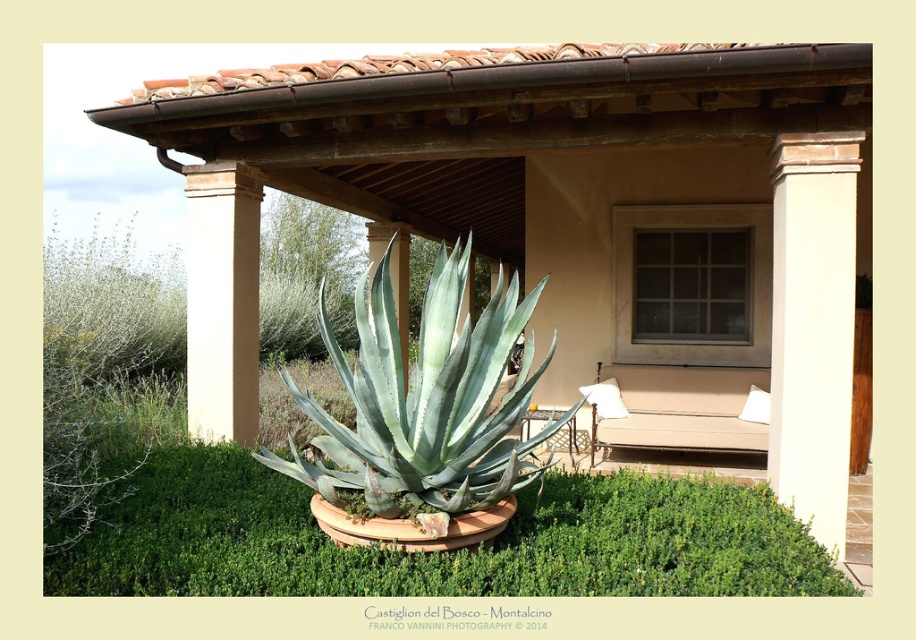
Question: Observing the image, what is the correct spatial positioning of green leafy grass at center in reference to green succulent at center?

Choices:
 (A) below
 (B) above

Answer: (A)

Question: Which point is farther to the camera?

Choices:
 (A) white smooth column at right
 (B) green succulent at center
 (C) green leafy grass at center

Answer: (A)

Question: Is green leafy grass at center wider than beige smooth column at center?

Choices:
 (A) yes
 (B) no

Answer: (A)

Question: Which of the following is the farthest from the observer?

Choices:
 (A) white smooth column at right
 (B) green leafy grass at center
 (C) brown wood pergola at center
 (D) green succulent at center

Answer: (A)

Question: Based on their relative distances, which object is nearer to the beige smooth column at center?

Choices:
 (A) white smooth column at right
 (B) green leafy grass at center
 (C) brown wood pergola at center

Answer: (C)

Question: Does green succulent at center have a smaller size compared to beige smooth column at center?

Choices:
 (A) no
 (B) yes

Answer: (A)